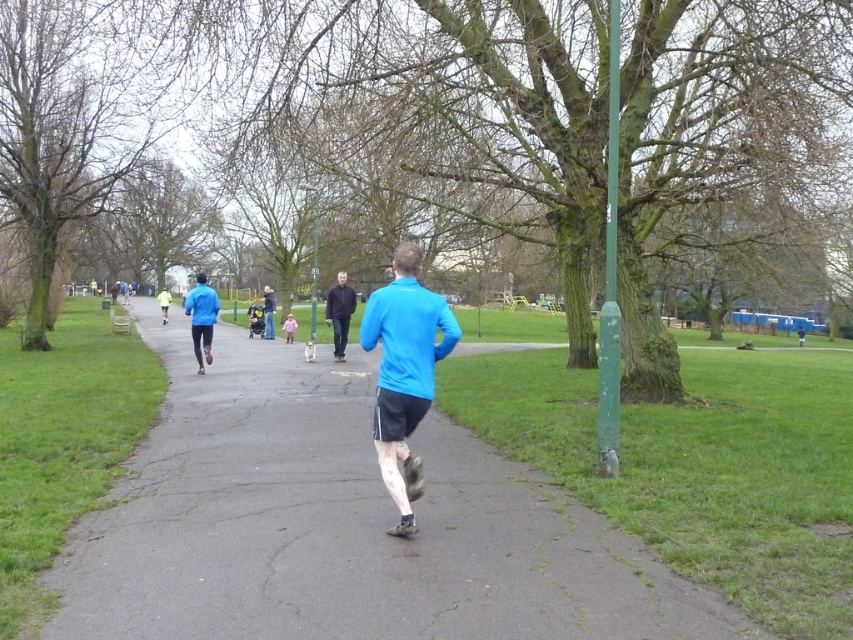
You are a photographer positioned at the end of the path. You want to take a photo of the dark brown leather jacket at center and the neon yellow jacket at center. Which one should you focus on first to ensure both are in focus?

The dark brown leather jacket at center is in front of the neon yellow jacket at center, so you should focus on the dark brown leather jacket at center first to ensure both are in focus.

What is the exact coordinate of the smooth asphalt path at center?

The smooth asphalt path at center is located at point (x=344, y=524).